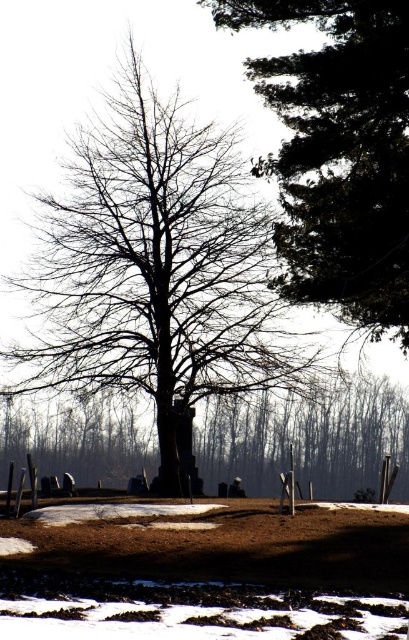
Can you confirm if bare wood tree at center is positioned to the right of dark green textured tree at upper right?

Incorrect, bare wood tree at center is not on the right side of dark green textured tree at upper right.

Based on the photo, is bare wood tree at center thinner than dark green textured tree at upper right?

No.

Which is behind, point (265, 230) or point (400, 140)?

Positioned behind is point (265, 230).

Identify the location of bare wood tree at center. (157, 269).

Is dark green textured tree at upper right wider than smooth brown tree trunk at center?

No, dark green textured tree at upper right is not wider than smooth brown tree trunk at center.

Who is positioned more to the right, dark green textured tree at upper right or smooth brown tree trunk at center?

dark green textured tree at upper right is more to the right.

Where is `dark green textured tree at upper right`? The width and height of the screenshot is (409, 640). dark green textured tree at upper right is located at coordinates (339, 154).

Does bare wood tree at center appear on the right side of smooth brown tree trunk at center?

In fact, bare wood tree at center is to the left of smooth brown tree trunk at center.

Is point (80, 163) more distant than point (397, 419)?

No, (80, 163) is in front of (397, 419).

Where is `bare wood tree at center`? bare wood tree at center is located at coordinates (157, 269).